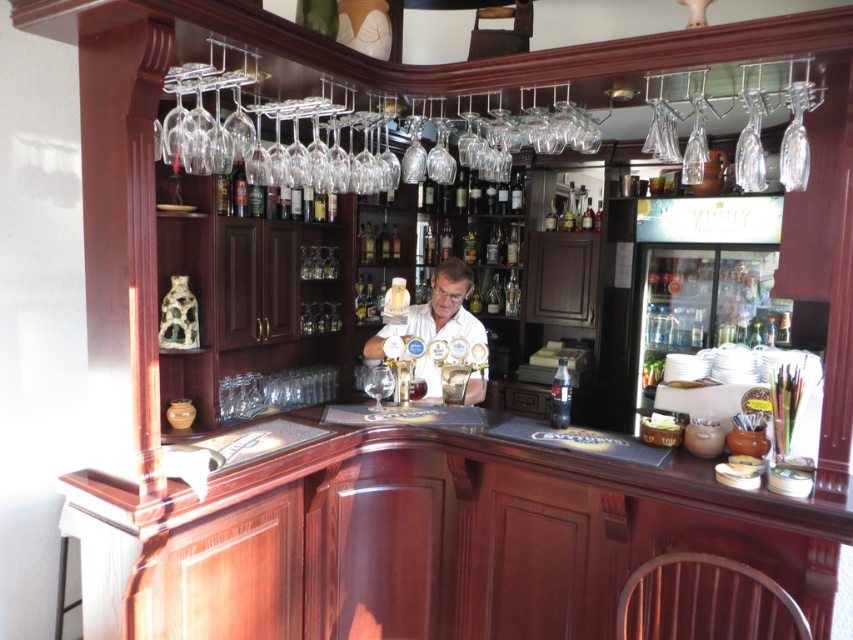
You are a bartender wearing a white matte shirt at center. You need to grab a glass from the shelf unit on the left side of the bar. Considering your height and the shirt you are wearing, can you comfortably reach the glasses hanging above the shelf unit on the left?

The glasses hanging above the shelf unit on the left are positioned higher than the bartender wearing the white matte shirt at center can comfortably reach without assistance, so they might need to use a stool or ladder to access them.

You are standing in front of the bar counter and want to reach the point at coordinates point (433, 364). Considering the bar counter is 1.2 meters high, can you comfortably reach that point without standing on something?

The point (433, 364) is 2.67 meters away from the viewer. Since the bar counter is only 1.2 meters high, you would need to stretch or stand on a stool to comfortably reach that point as it is beyond typical arm reach distance.